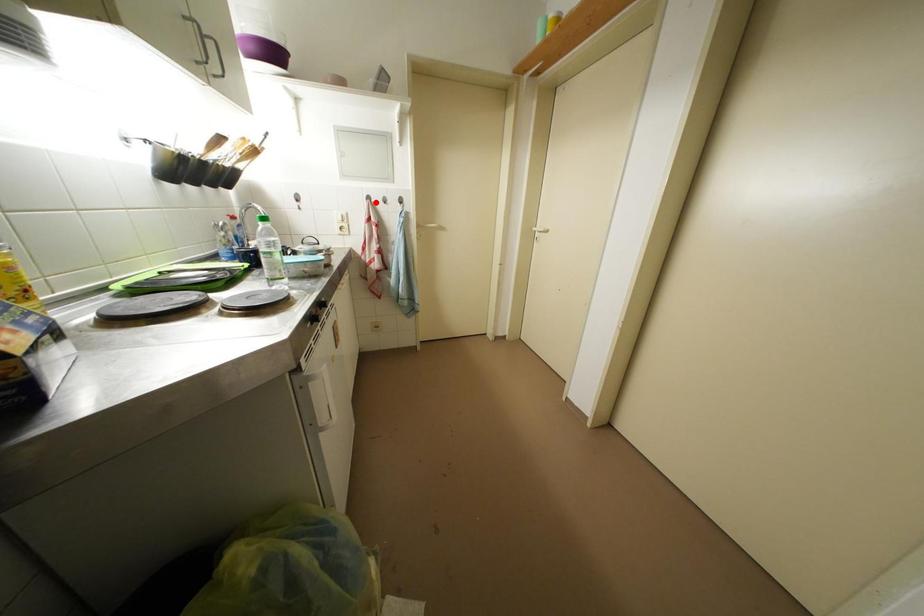
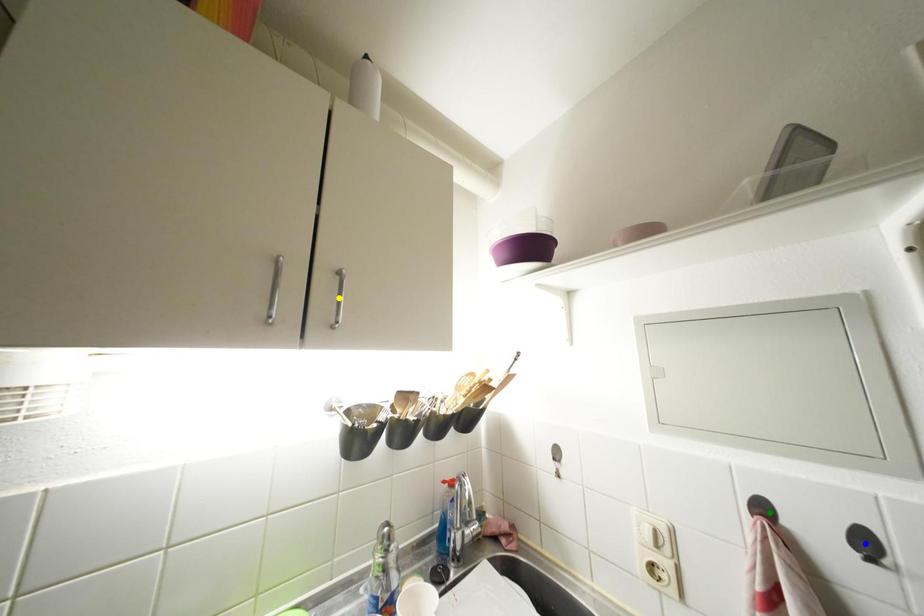
Question: I am providing you with two images of the same scene from different viewpoints. A red point is marked on the first image. You are given multiple points on the second image. Which mark in image 2 goes with the point in image 1?

Choices:
 (A) green point
 (B) yellow point
 (C) blue point

Answer: (A)